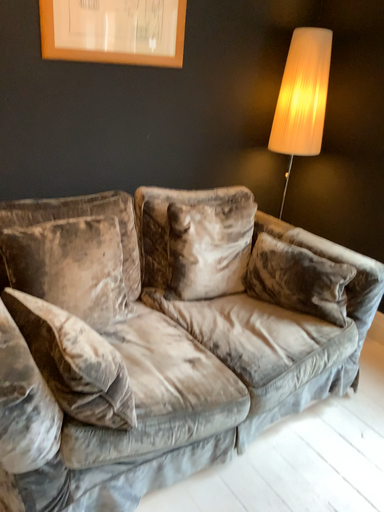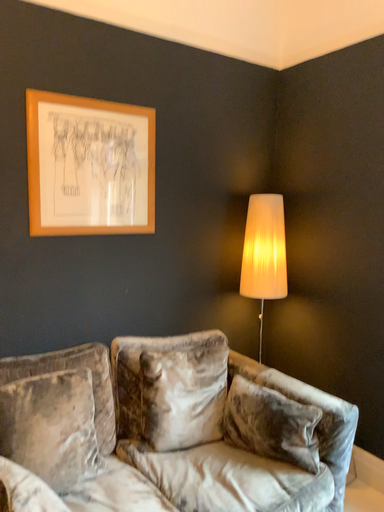
Question: Which way did the camera rotate in the video?

Choices:
 (A) rotated downward
 (B) rotated upward

Answer: (B)